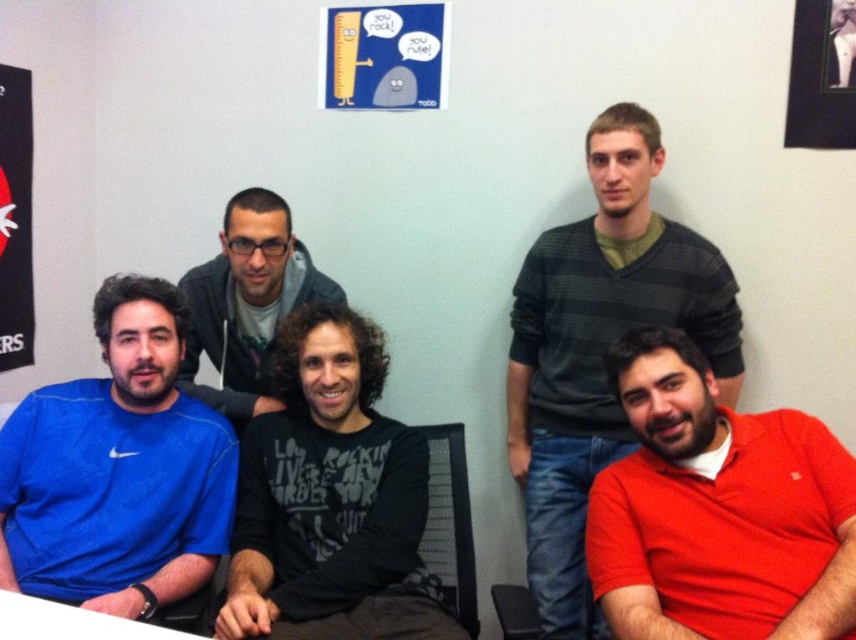
Question: Is matte paper poster at upper center above black fabric poster at upper left?

Choices:
 (A) yes
 (B) no

Answer: (A)

Question: Does red matte shirt at lower right lie behind black fabric poster at upper left?

Choices:
 (A) yes
 (B) no

Answer: (B)

Question: Which of the following is the closest to the observer?

Choices:
 (A) (535, 252)
 (B) (162, 456)
 (C) (626, 621)

Answer: (C)

Question: Which point is closer to the camera?

Choices:
 (A) (248, 376)
 (B) (397, 74)
 (C) (553, 433)
 (D) (24, 557)

Answer: (D)

Question: Does matte paper poster at upper center appear under white plastic table at lower left?

Choices:
 (A) no
 (B) yes

Answer: (A)

Question: Among these objects, which one is nearest to the camera?

Choices:
 (A) green striped sweater at upper right
 (B) black matte shirt at center
 (C) matte black hoodie at center

Answer: (B)